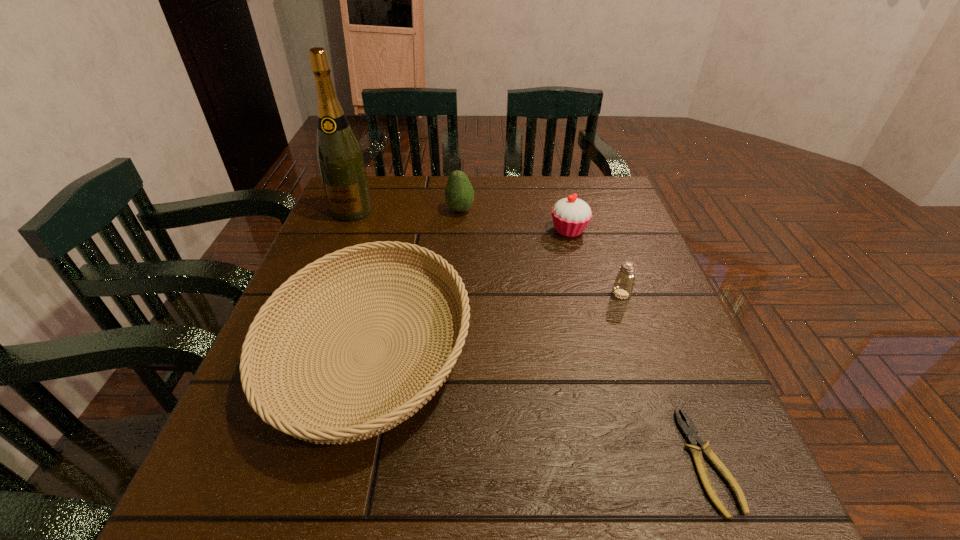
The image size is (960, 540). I want to click on free spot located 0.270m on the back of the saltshaker, so click(x=594, y=218).

At what (x,y) coordinates should I click in order to perform the action: click on blank area located on the left of the shortest object. Please return your answer as a coordinate pair (x, y). The image size is (960, 540). Looking at the image, I should click on (562, 461).

At what (x,y) coordinates should I click in order to perform the action: click on wine bottle present at the far edge. Please return your answer as a coordinate pair (x, y). The height and width of the screenshot is (540, 960). Looking at the image, I should click on click(339, 156).

This screenshot has height=540, width=960. I want to click on avocado at the far edge, so click(459, 195).

Where is `cupcake at the far edge`? cupcake at the far edge is located at coordinates (571, 215).

Identify the location of object present at the near edge. (691, 434).

At what (x,y) coordinates should I click in order to perform the action: click on wine bottle at the left edge. Please return your answer as a coordinate pair (x, y). Looking at the image, I should click on (339, 156).

This screenshot has width=960, height=540. What are the coordinates of `basket that is at the left edge` in the screenshot? It's located at (368, 423).

Locate an element on the screen. This screenshot has width=960, height=540. cupcake present at the right edge is located at coordinates (571, 215).

Where is `saltshaker present at the right edge`? This screenshot has width=960, height=540. saltshaker present at the right edge is located at coordinates (623, 286).